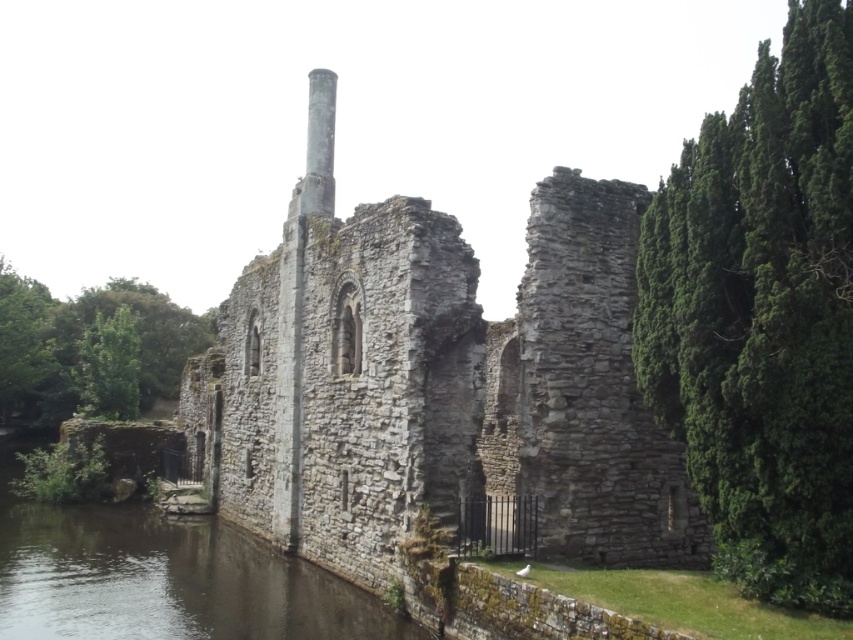
Which is more to the left, stone wall at center or dark gray stone river at lower left?

From the viewer's perspective, dark gray stone river at lower left appears more on the left side.

Does stone wall at center appear under dark gray stone river at lower left?

No.

What are the coordinates of `stone wall at center` in the screenshot? It's located at [x=434, y=380].